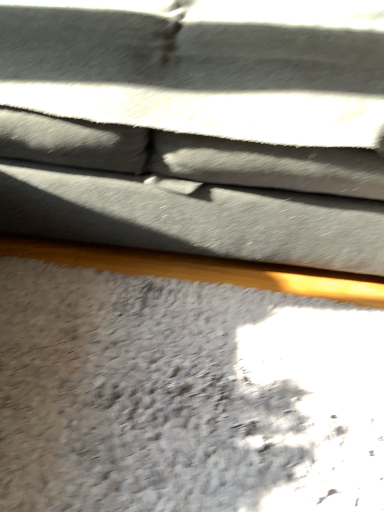
Measure the distance between textured gray fabric couch at upper center and camera.

textured gray fabric couch at upper center and camera are 26.38 inches apart from each other.

The image size is (384, 512). I want to click on textured gray fabric couch at upper center, so click(x=197, y=127).

The image size is (384, 512). Describe the element at coordinates (197, 127) in the screenshot. I see `textured gray fabric couch at upper center` at that location.

The image size is (384, 512). In order to click on textured gray fabric couch at upper center in this screenshot , I will do `click(197, 127)`.